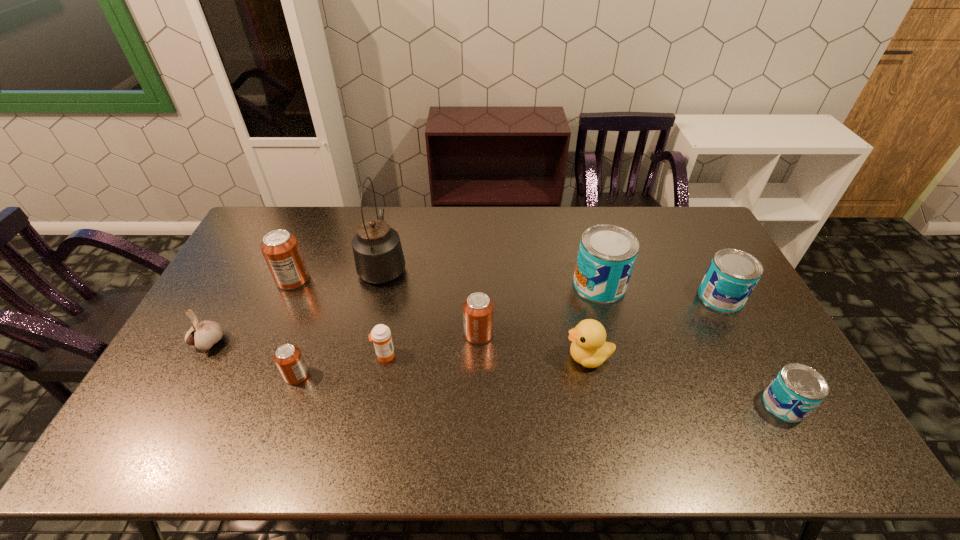
Where is `object that is positioned at the left edge`? object that is positioned at the left edge is located at coordinates (203, 335).

Where is `blank space at the far edge of the desktop`? The image size is (960, 540). blank space at the far edge of the desktop is located at coordinates (331, 214).

At what (x,y) coordinates should I click in order to perform the action: click on blank area at the near edge. Please return your answer as a coordinate pair (x, y). Looking at the image, I should click on (411, 431).

You are a GUI agent. You are given a task and a screenshot of the screen. Output one action in this format:
    pyautogui.click(x=<x>, y=<y>)
    Task: Click on the free space at the left edge of the desktop
    The width and height of the screenshot is (960, 540).
    Given the screenshot: What is the action you would take?
    pyautogui.click(x=256, y=246)

You are a GUI agent. You are given a task and a screenshot of the screen. Output one action in this format:
    pyautogui.click(x=<x>, y=<y>)
    Task: Click on the vacant space at the right edge of the desktop
    The width and height of the screenshot is (960, 540).
    Given the screenshot: What is the action you would take?
    pyautogui.click(x=695, y=290)

In the image, there is a desktop. Identify the location of blank space at the far right corner. (683, 224).

What are the coordinates of `vacant point located between the leftmost object and the leftmost can` in the screenshot? It's located at (252, 311).

At what (x,y) coordinates should I click in order to perform the action: click on free space between the nearest blue can and the yellow duck. Please return your answer as a coordinate pair (x, y). Looking at the image, I should click on (686, 381).

Find the location of `free space that is in between the leftmost blue can and the second biggest blue can`. free space that is in between the leftmost blue can and the second biggest blue can is located at coordinates (660, 291).

Where is `free space that is in between the second orange can from left to right and the orange medicine`? The width and height of the screenshot is (960, 540). free space that is in between the second orange can from left to right and the orange medicine is located at coordinates (341, 366).